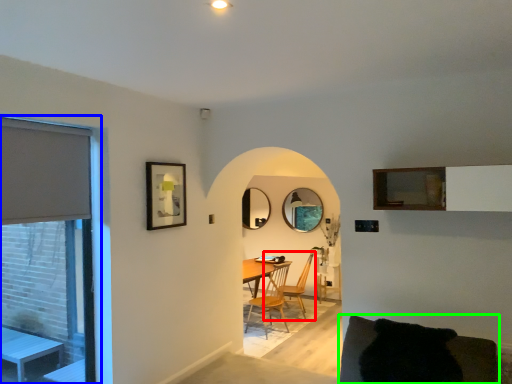
Question: Which object is the closest to the chair (highlighted by a red box)? Choose among these: window (highlighted by a blue box) or couch (highlighted by a green box).

Choices:
 (A) window
 (B) couch

Answer: (A)